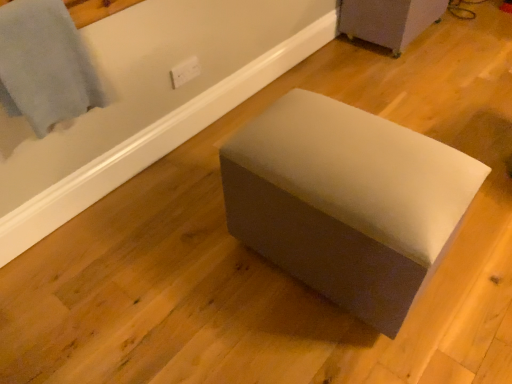
Question: Is matte gray ottoman at center, which is counted as the first furniture, starting from the back, taller or shorter than light blue fabric at upper left?

Choices:
 (A) tall
 (B) short

Answer: (B)

Question: Does point (352, 16) appear closer or farther from the camera than point (81, 48)?

Choices:
 (A) closer
 (B) farther

Answer: (B)

Question: Which of these objects is positioned farthest from the matte gray ottoman at center, the first furniture positioned from the right?

Choices:
 (A) suede-like gray ottoman at center, the first furniture viewed from the front
 (B) light blue fabric at upper left
 (C) suede-like gray ottoman at center

Answer: (B)

Question: Which object is positioned farthest from the matte gray ottoman at center, the 2th furniture positioned from the front?

Choices:
 (A) suede-like gray ottoman at center
 (B) light blue fabric at upper left
 (C) suede-like gray ottoman at center, the 1th furniture positioned from the bottom

Answer: (B)